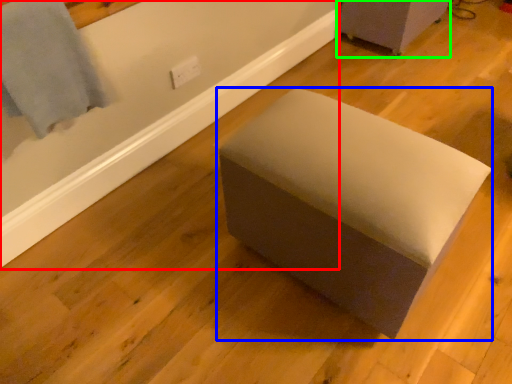
Question: Which object is positioned farthest from bath (highlighted by a red box)? Select from furniture (highlighted by a blue box) and furniture (highlighted by a green box).

Choices:
 (A) furniture
 (B) furniture

Answer: (B)